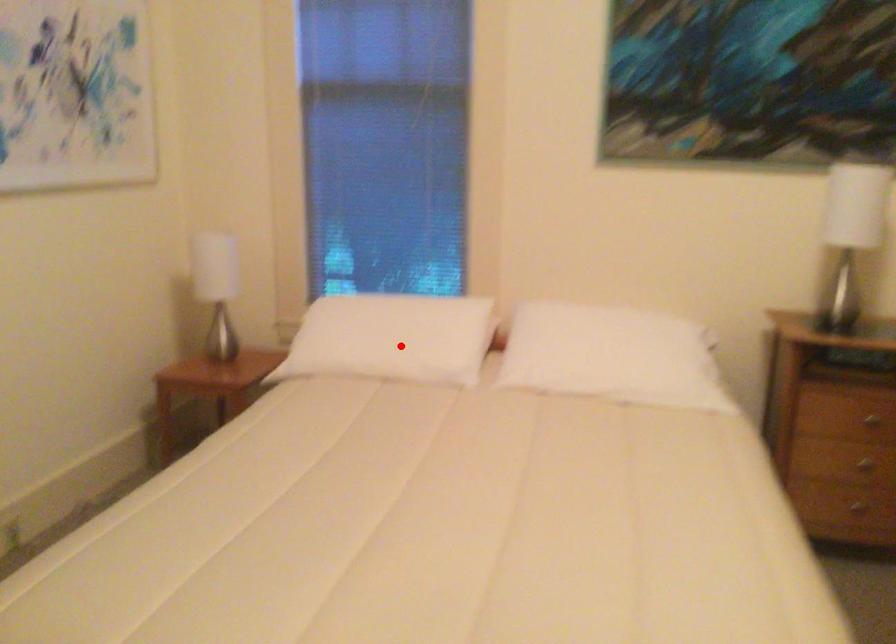
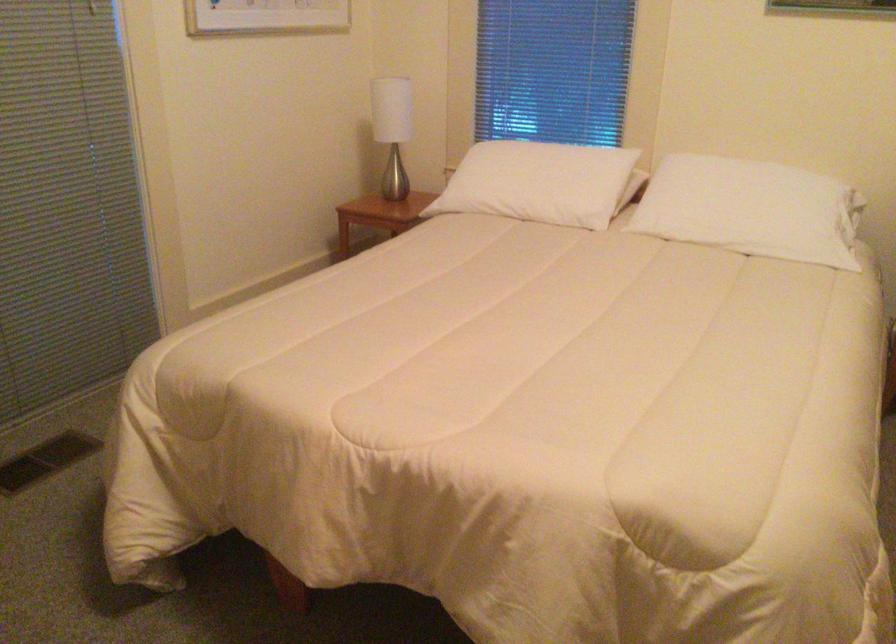
Where in the second image is the point corresponding to the highlighted location from the first image?

(538, 183)